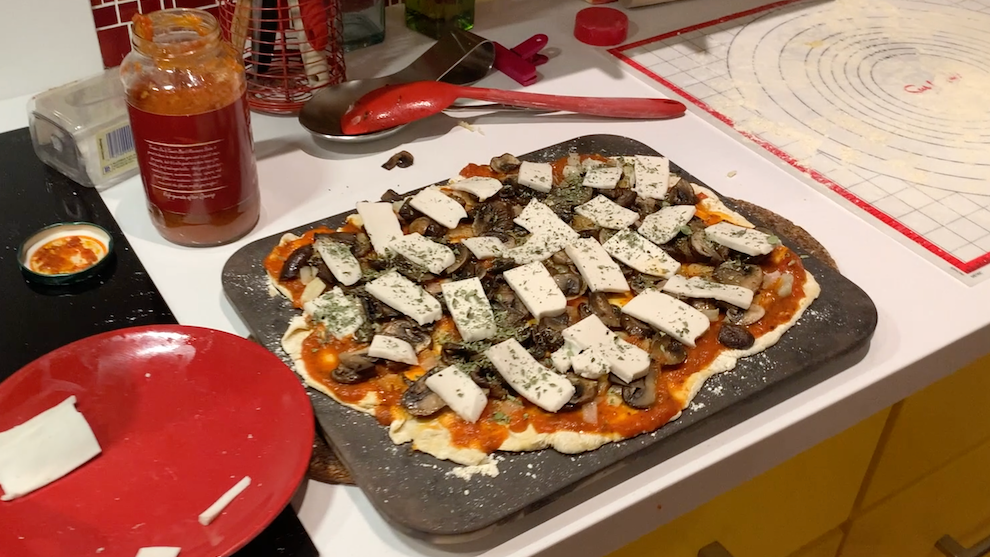
At what (x,y) coordinates should I click in order to perform the action: click on spoon rest. Please return your answer as a coordinate pair (x, y). Image resolution: width=990 pixels, height=557 pixels. Looking at the image, I should click on (322, 119).